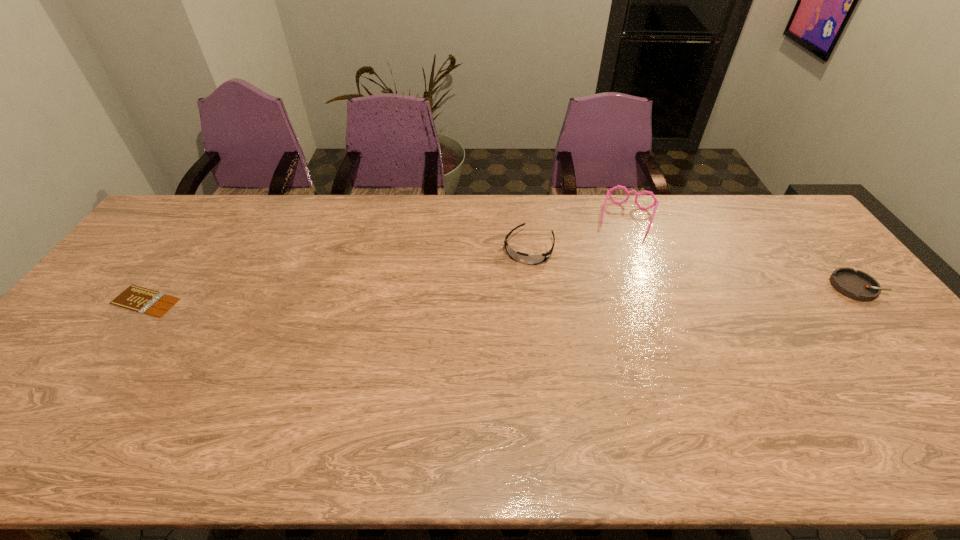
This screenshot has height=540, width=960. In order to click on vacant space situated 0.350m on the lenses of the second tallest object in this screenshot , I will do `click(478, 353)`.

Locate an element on the screen. The height and width of the screenshot is (540, 960). vacant space located 0.210m on the lenses of the second tallest object is located at coordinates (497, 314).

The width and height of the screenshot is (960, 540). Identify the location of vacant space positioned 0.190m on the lenses of the second tallest object. (500, 309).

At what (x,y) coordinates should I click in order to perform the action: click on vacant space located 0.120m on the arms of the spectacles. Please return your answer as a coordinate pair (x, y). Looking at the image, I should click on (617, 261).

Identify the location of vacant space located 0.360m on the arms of the spectacles. coord(602,316).

Find the location of a particular element. The height and width of the screenshot is (540, 960). free spot located 0.310m on the arms of the spectacles is located at coordinates (605, 303).

You are a GUI agent. You are given a task and a screenshot of the screen. Output one action in this format:
    pyautogui.click(x=<x>, y=<y>)
    Task: Click on the sunglasses that is at the far edge
    This screenshot has height=540, width=960.
    Given the screenshot: What is the action you would take?
    pyautogui.click(x=516, y=255)

The image size is (960, 540). Find the location of `spectacles located at the far edge`. spectacles located at the far edge is located at coordinates (656, 201).

Identify the location of object that is at the left edge. The height and width of the screenshot is (540, 960). (135, 298).

Where is `object that is at the right edge`? The height and width of the screenshot is (540, 960). object that is at the right edge is located at coordinates (857, 285).